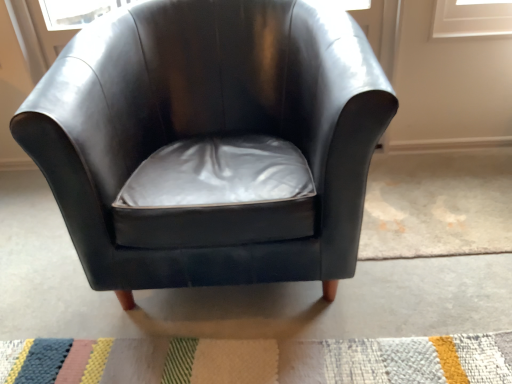
Question: Considering the relative positions of glossy leather chair at center and multicolored woven mat at lower center in the image provided, is glossy leather chair at center behind multicolored woven mat at lower center?

Choices:
 (A) yes
 (B) no

Answer: (B)

Question: Considering the relative sizes of glossy leather chair at center and multicolored woven mat at lower center in the image provided, is glossy leather chair at center bigger than multicolored woven mat at lower center?

Choices:
 (A) no
 (B) yes

Answer: (B)

Question: Does glossy leather chair at center turn towards multicolored woven mat at lower center?

Choices:
 (A) yes
 (B) no

Answer: (A)

Question: Are glossy leather chair at center and multicolored woven mat at lower center far apart?

Choices:
 (A) yes
 (B) no

Answer: (B)

Question: Is glossy leather chair at center positioned beyond the bounds of multicolored woven mat at lower center?

Choices:
 (A) no
 (B) yes

Answer: (B)

Question: From a real-world perspective, is glossy leather chair at center positioned under multicolored woven mat at lower center based on gravity?

Choices:
 (A) yes
 (B) no

Answer: (B)

Question: Is multicolored woven mat at lower center positioned behind glossy leather chair at center?

Choices:
 (A) yes
 (B) no

Answer: (A)

Question: Can you confirm if multicolored woven mat at lower center is taller than glossy leather chair at center?

Choices:
 (A) yes
 (B) no

Answer: (B)

Question: Can you confirm if multicolored woven mat at lower center is smaller than glossy leather chair at center?

Choices:
 (A) no
 (B) yes

Answer: (B)

Question: From a real-world perspective, is multicolored woven mat at lower center over glossy leather chair at center?

Choices:
 (A) no
 (B) yes

Answer: (A)

Question: Could you tell me if multicolored woven mat at lower center is turned towards glossy leather chair at center?

Choices:
 (A) no
 (B) yes

Answer: (A)

Question: Does multicolored woven mat at lower center have a lesser height compared to glossy leather chair at center?

Choices:
 (A) no
 (B) yes

Answer: (B)

Question: From a real-world perspective, is glossy leather chair at center above or below multicolored woven mat at lower center?

Choices:
 (A) above
 (B) below

Answer: (A)